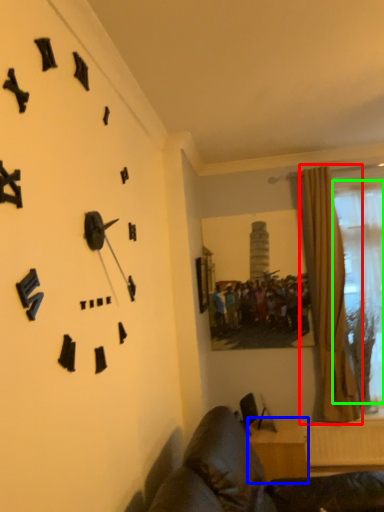
Question: Which object is the farthest from curtain (highlighted by a red box)? Choose among these: furniture (highlighted by a blue box) or bay window (highlighted by a green box).

Choices:
 (A) furniture
 (B) bay window

Answer: (A)